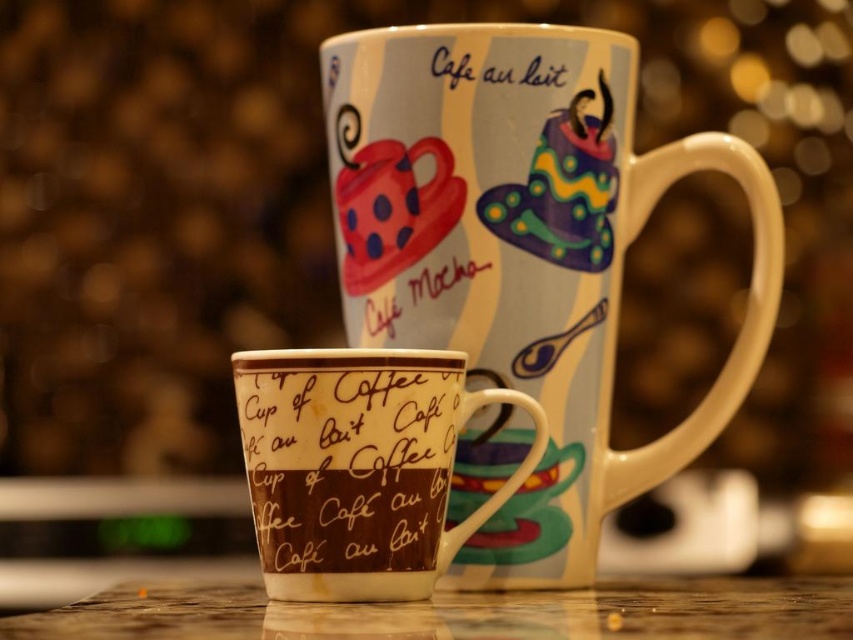
Question: Can you confirm if wooden table at lower center is bigger than matte white text at upper center?

Choices:
 (A) no
 (B) yes

Answer: (B)

Question: Is matte ceramic mug at center further to camera compared to matte white text at upper center?

Choices:
 (A) yes
 (B) no

Answer: (B)

Question: Which is farther from the wooden table at lower center?

Choices:
 (A) brown matte cup of coffee at center
 (B) matte ceramic mug at center

Answer: (B)

Question: Estimate the real-world distances between objects in this image. Which object is farther from the brown matte cup of coffee at center?

Choices:
 (A) matte ceramic mug at center
 (B) wooden table at lower center

Answer: (A)

Question: Where is matte ceramic mug at center located in relation to brown matte cup of coffee at center in the image?

Choices:
 (A) right
 (B) left

Answer: (A)

Question: Which point is farther from the camera taking this photo?

Choices:
 (A) [663, 621]
 (B) [547, 400]
 (C) [512, 70]

Answer: (B)